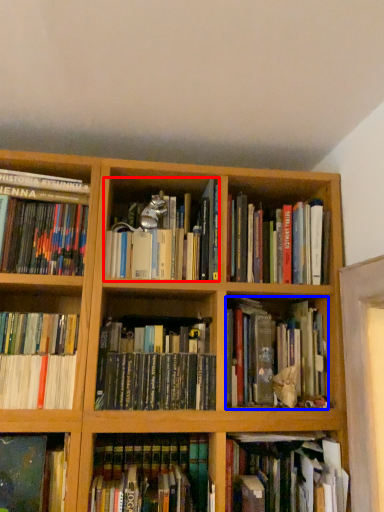
Question: Which point is closer to the camera, book (highlighted by a red box) or book (highlighted by a blue box)?

Choices:
 (A) book
 (B) book

Answer: (A)